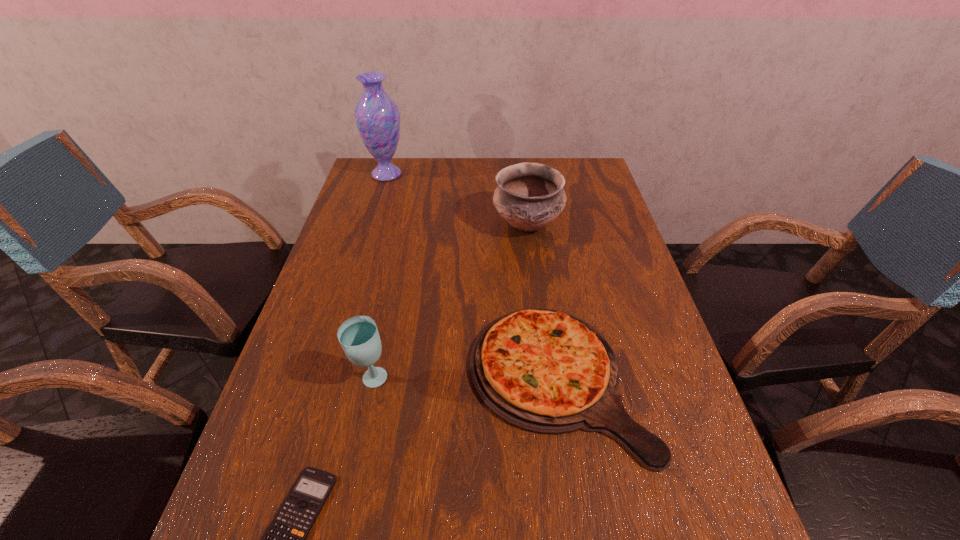
At what (x,y) coordinates should I click in order to perform the action: click on vase that is at the left edge. Please return your answer as a coordinate pair (x, y). The width and height of the screenshot is (960, 540). Looking at the image, I should click on (377, 116).

Identify the location of glass at the left edge. The height and width of the screenshot is (540, 960). (359, 337).

The image size is (960, 540). In order to click on object at the right edge in this screenshot , I will do `click(545, 371)`.

Locate an element on the screen. object at the far left corner is located at coordinates (377, 116).

Locate an element on the screen. vacant area at the far edge of the desktop is located at coordinates (474, 176).

This screenshot has width=960, height=540. What are the coordinates of `vacant area at the left edge of the desktop` in the screenshot? It's located at [x=283, y=408].

Locate an element on the screen. vacant space at the right edge is located at coordinates (622, 294).

The image size is (960, 540). I want to click on vacant space at the far left corner, so tap(363, 170).

The image size is (960, 540). I want to click on blank region between the glass and the vase, so click(x=378, y=276).

Identify the location of vacant area that lies between the pottery and the pizza. (542, 302).